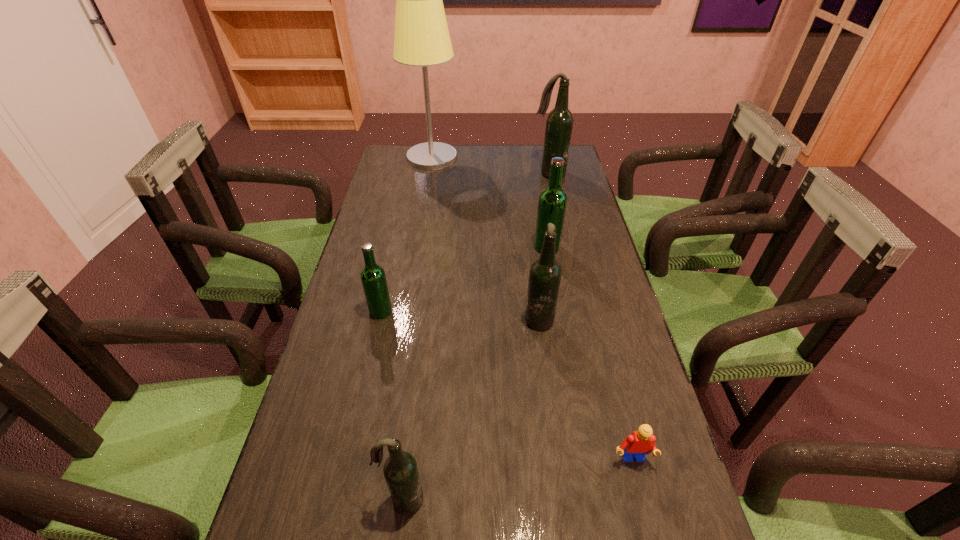
Find the location of `table lamp at the far edge`. table lamp at the far edge is located at coordinates (422, 38).

Where is `beer bottle present at the far edge`? beer bottle present at the far edge is located at coordinates (559, 123).

This screenshot has width=960, height=540. In order to click on table lamp that is at the left edge in this screenshot , I will do `click(422, 38)`.

Locate an element on the screen. The height and width of the screenshot is (540, 960). beer bottle present at the left edge is located at coordinates (373, 277).

Locate an element on the screen. Lego present at the right edge is located at coordinates [641, 442].

Find the location of a particular element. The image size is (960, 540). object located at the far left corner is located at coordinates (422, 38).

Find the location of a particular element. object that is positioned at the far right corner is located at coordinates tap(559, 123).

Where is `free space at the far edge`? The height and width of the screenshot is (540, 960). free space at the far edge is located at coordinates (478, 147).

In the image, there is a desktop. At what (x,y) coordinates should I click in order to perform the action: click on vacant space at the left edge. Please return your answer as a coordinate pair (x, y). Looking at the image, I should click on (406, 242).

The width and height of the screenshot is (960, 540). Identify the location of free space at the right edge of the desktop. (574, 200).